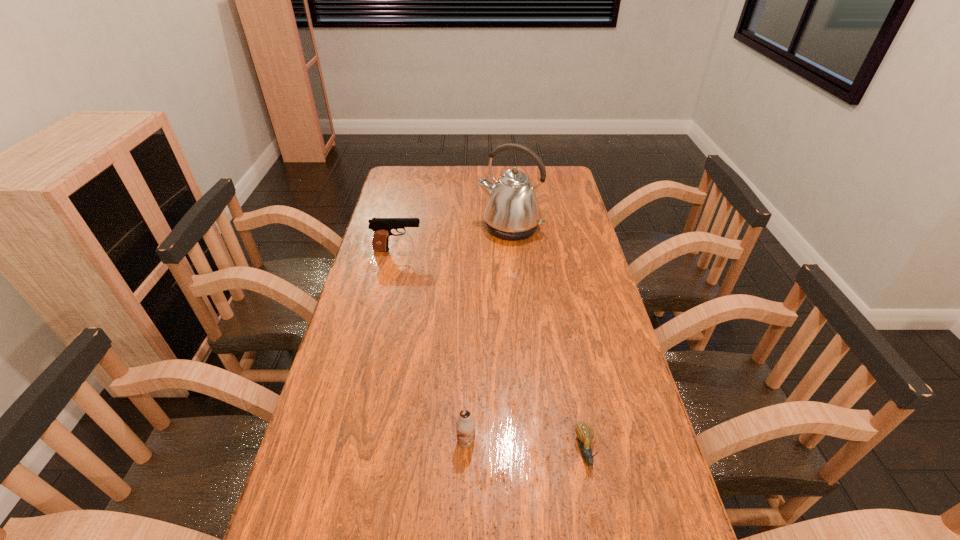
Identify the location of free area in between the tallest object and the shortest object. The height and width of the screenshot is (540, 960). (548, 340).

Locate an element on the screen. vacant space in between the chocolate milk and the shortest object is located at coordinates (526, 446).

Locate an element on the screen. vacant region between the chocolate milk and the leftmost object is located at coordinates (432, 346).

I want to click on vacant point located between the escargot and the kettle, so click(548, 340).

Locate an element on the screen. free space between the escargot and the tallest object is located at coordinates (548, 340).

You are a GUI agent. You are given a task and a screenshot of the screen. Output one action in this format:
    pyautogui.click(x=<x>, y=<y>)
    Task: Click on the unoccupied area between the chocolate milk and the second farthest object
    
    Given the screenshot: What is the action you would take?
    432,346

What are the coordinates of `empty space between the escargot and the chocolate milk` in the screenshot? It's located at pyautogui.click(x=526, y=446).

Point out which object is positioned as the third nearest to the chocolate milk. Please provide its 2D coordinates. Your answer should be formatted as a tuple, i.e. [(x, y)], where the tuple contains the x and y coordinates of a point satisfying the conditions above.

[(512, 212)]

Identify which object is the closest to the chocolate milk. Please provide its 2D coordinates. Your answer should be formatted as a tuple, i.e. [(x, y)], where the tuple contains the x and y coordinates of a point satisfying the conditions above.

[(585, 433)]

Where is `vacant space that satisfies the following two spatial constraints: 1. at the barrel of the pistol; 2. on the left side of the chocolate milk`? vacant space that satisfies the following two spatial constraints: 1. at the barrel of the pistol; 2. on the left side of the chocolate milk is located at coordinates (354, 441).